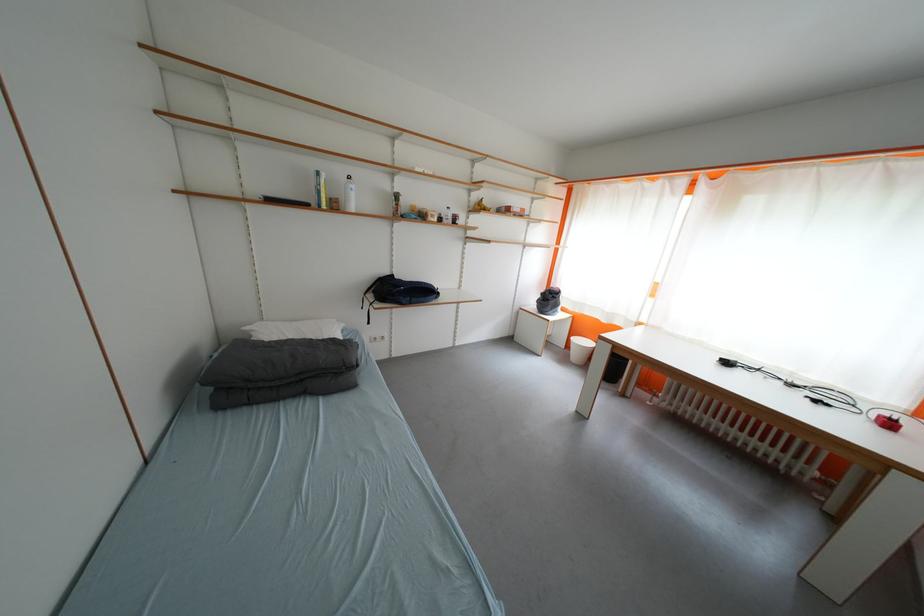
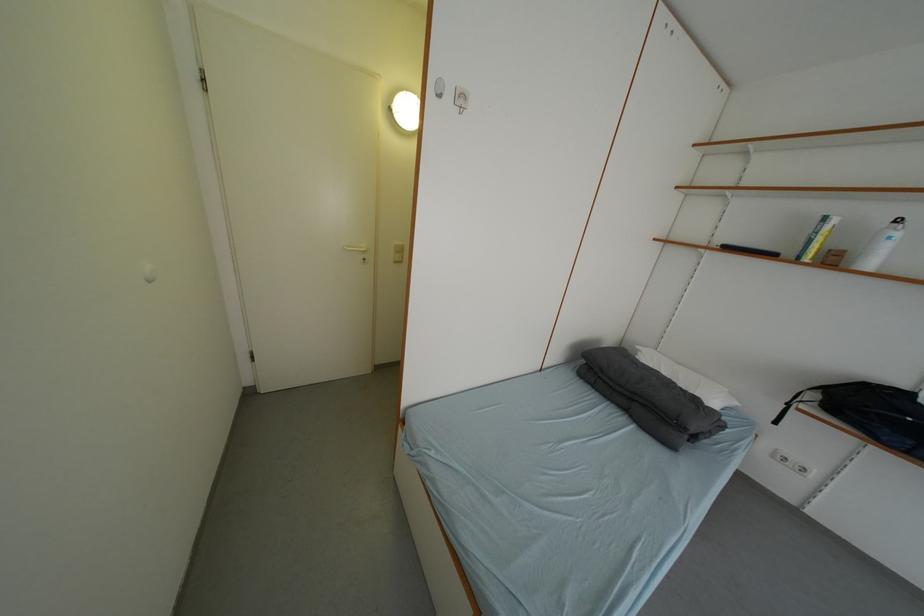
Question: The first image is from the beginning of the video and the second image is from the end. How did the camera likely rotate when shooting the video?

Choices:
 (A) Left
 (B) Right
 (C) Up
 (D) Down

Answer: (A)